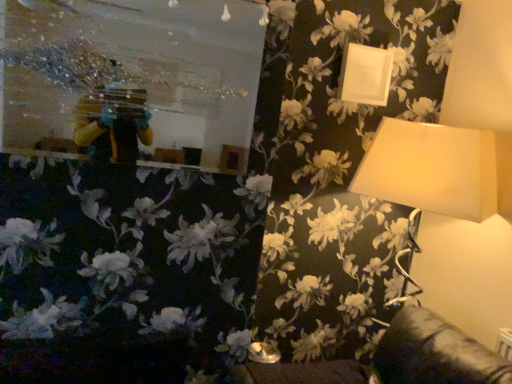
Question: Does metallic reflective mirror at upper left contain matte white lampshade at upper right?

Choices:
 (A) yes
 (B) no

Answer: (B)

Question: From the image's perspective, is metallic reflective mirror at upper left over matte white lampshade at upper right?

Choices:
 (A) no
 (B) yes

Answer: (B)

Question: From a real-world perspective, is metallic reflective mirror at upper left positioned under matte white lampshade at upper right based on gravity?

Choices:
 (A) no
 (B) yes

Answer: (A)

Question: Is metallic reflective mirror at upper left not inside matte white lampshade at upper right?

Choices:
 (A) no
 (B) yes

Answer: (B)

Question: Can you confirm if metallic reflective mirror at upper left is bigger than matte white lampshade at upper right?

Choices:
 (A) no
 (B) yes

Answer: (A)

Question: In terms of height, does matte white lampshade at upper right look taller or shorter compared to metallic reflective mirror at upper left?

Choices:
 (A) short
 (B) tall

Answer: (B)

Question: Relative to metallic reflective mirror at upper left, is matte white lampshade at upper right in front or behind?

Choices:
 (A) front
 (B) behind

Answer: (B)

Question: Is matte white lampshade at upper right situated inside metallic reflective mirror at upper left or outside?

Choices:
 (A) inside
 (B) outside

Answer: (B)

Question: Considering the positions of matte white lampshade at upper right and metallic reflective mirror at upper left in the image, is matte white lampshade at upper right wider or thinner than metallic reflective mirror at upper left?

Choices:
 (A) wide
 (B) thin

Answer: (A)

Question: From a real-world perspective, is white matte picture frame at upper right physically located above or below metallic reflective mirror at upper left?

Choices:
 (A) below
 (B) above

Answer: (B)

Question: Considering the positions of white matte picture frame at upper right and metallic reflective mirror at upper left in the image, is white matte picture frame at upper right bigger or smaller than metallic reflective mirror at upper left?

Choices:
 (A) small
 (B) big

Answer: (A)

Question: From the image's perspective, relative to metallic reflective mirror at upper left, is white matte picture frame at upper right above or below?

Choices:
 (A) below
 (B) above

Answer: (B)

Question: Considering the relative positions of white matte picture frame at upper right and metallic reflective mirror at upper left in the image provided, is white matte picture frame at upper right to the left or to the right of metallic reflective mirror at upper left?

Choices:
 (A) right
 (B) left

Answer: (A)

Question: In terms of height, does metallic reflective mirror at upper left look taller or shorter compared to white matte picture frame at upper right?

Choices:
 (A) short
 (B) tall

Answer: (B)

Question: Is metallic reflective mirror at upper left bigger or smaller than white matte picture frame at upper right?

Choices:
 (A) small
 (B) big

Answer: (B)